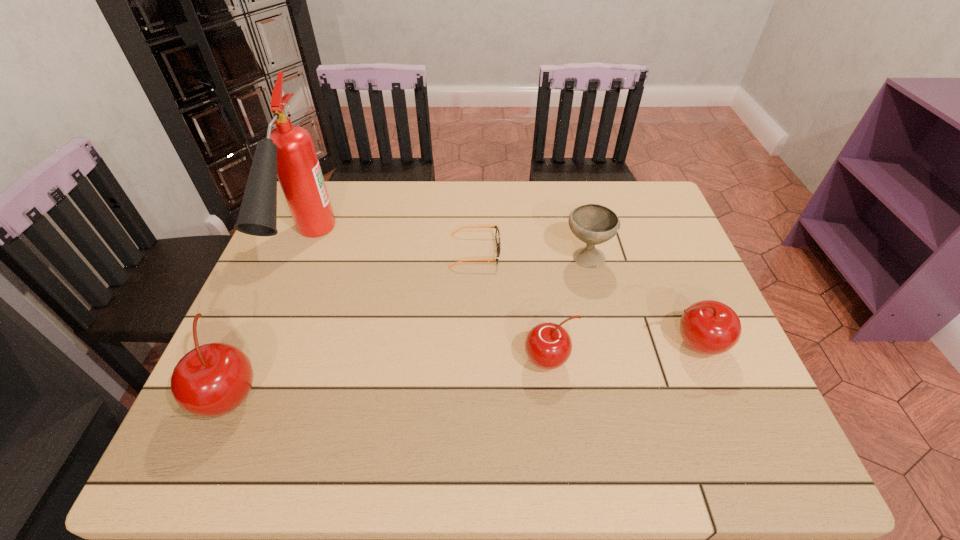
Locate an element on the screen. The image size is (960, 540). vacant area located on the back of the second cherry from right to left is located at coordinates (537, 266).

You are a GUI agent. You are given a task and a screenshot of the screen. Output one action in this format:
    pyautogui.click(x=<x>, y=<y>)
    Task: Click on the vacant space situated 0.130m on the left of the rightmost cherry
    This screenshot has height=540, width=960.
    Given the screenshot: What is the action you would take?
    pyautogui.click(x=606, y=345)

Identify the location of vacant area situated 0.220m at the nozzle of the fire extinguisher. The width and height of the screenshot is (960, 540). (253, 385).

Where is `free space located on the front-facing side of the shortest object`? free space located on the front-facing side of the shortest object is located at coordinates (558, 252).

Locate an element on the screen. This screenshot has width=960, height=540. vacant region located 0.060m on the left of the chalice is located at coordinates (540, 258).

This screenshot has width=960, height=540. What are the coordinates of `object present at the far edge` in the screenshot? It's located at (288, 152).

This screenshot has width=960, height=540. In order to click on cherry positioned at the left edge in this screenshot , I will do `click(213, 379)`.

Locate an element on the screen. Image resolution: width=960 pixels, height=540 pixels. fire extinguisher at the left edge is located at coordinates (288, 152).

Where is `object located in the right edge section of the desktop`? object located in the right edge section of the desktop is located at coordinates (708, 327).

This screenshot has width=960, height=540. Find the location of `object positioned at the far left corner`. object positioned at the far left corner is located at coordinates (288, 152).